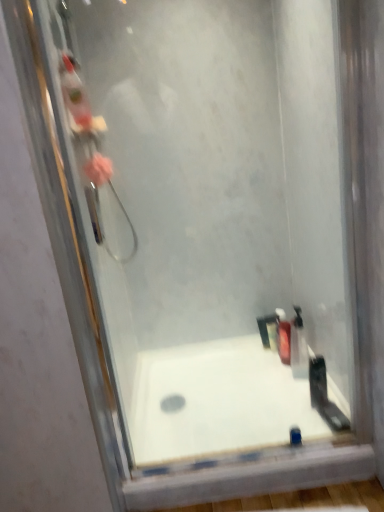
Where is `black plastic razor at right, the third toiletry when ordered from back to front`? The image size is (384, 512). black plastic razor at right, the third toiletry when ordered from back to front is located at coordinates (318, 381).

In order to click on translucent plastic bottle at lower right, which is the second toiletry from front to back in this screenshot , I will do `click(298, 346)`.

Which is behind, point (210, 454) or point (287, 364)?

The point (287, 364) is behind.

From the image's perspective, which one is positioned lower, white glossy bathtub at center or translucent plastic soap dispenser at lower right, the 3th toiletry when ordered from front to back?

From the image's view, white glossy bathtub at center is below.

Based on their positions, is white glossy bathtub at center located to the left or right of translucent plastic soap dispenser at lower right, the 3th toiletry when ordered from front to back?

white glossy bathtub at center is positioned on translucent plastic soap dispenser at lower right, the 3th toiletry when ordered from front to back,'s left side.

Is white glossy bathtub at center thinner than translucent plastic soap dispenser at lower right, placed as the first toiletry when sorted from back to front?

No.

Can you confirm if pink fluffy sponge at left is smaller than translucent plastic soap dispenser at lower right, placed as the first toiletry when sorted from back to front?

Correct, pink fluffy sponge at left occupies less space than translucent plastic soap dispenser at lower right, placed as the first toiletry when sorted from back to front.

Is pink fluffy sponge at left placed right next to translucent plastic soap dispenser at lower right, placed as the first toiletry when sorted from back to front?

There is a gap between pink fluffy sponge at left and translucent plastic soap dispenser at lower right, placed as the first toiletry when sorted from back to front.

Considering the positions of objects pink fluffy sponge at left and translucent plastic soap dispenser at lower right, the 3th toiletry when ordered from front to back, in the image provided, who is in front, pink fluffy sponge at left or translucent plastic soap dispenser at lower right, the 3th toiletry when ordered from front to back,?

pink fluffy sponge at left.

I want to click on bathtub below the pink fluffy sponge at left (from a real-world perspective), so click(217, 401).

Which object is closer to the camera, white glossy bathtub at center or pink fluffy sponge at left?

pink fluffy sponge at left is closer to the camera.

Is white glossy bathtub at center positioned with its back to pink fluffy sponge at left?

white glossy bathtub at center does not have its back to pink fluffy sponge at left.

Is white glossy bathtub at center next to pink fluffy sponge at left and touching it?

There is a gap between white glossy bathtub at center and pink fluffy sponge at left.

Is pink fluffy sponge at left inside or outside of white glossy bathtub at center?

The correct answer is: outside.

Is pink fluffy sponge at left at the right side of white glossy bathtub at center?

In fact, pink fluffy sponge at left is to the left of white glossy bathtub at center.

Is pink fluffy sponge at left closer to the viewer compared to white glossy bathtub at center?

Yes, pink fluffy sponge at left is closer to the camera.

Considering the sizes of objects pink fluffy sponge at left and white glossy bathtub at center in the image provided, who is thinner, pink fluffy sponge at left or white glossy bathtub at center?

With smaller width is pink fluffy sponge at left.

In terms of width, does pink fluffy sponge at left look wider or thinner when compared to black plastic razor at right, which is the first toiletry in front-to-back order?

Clearly, pink fluffy sponge at left has more width compared to black plastic razor at right, which is the first toiletry in front-to-back order.

In terms of size, does pink fluffy sponge at left appear bigger or smaller than black plastic razor at right, the third toiletry when ordered from back to front?

In the image, pink fluffy sponge at left appears to be larger than black plastic razor at right, the third toiletry when ordered from back to front.

At what (x,y) coordinates should I click in order to perform the action: click on flower in front of the black plastic razor at right, the third toiletry when ordered from back to front. Please return your answer as a coordinate pair (x, y). This screenshot has width=384, height=512. Looking at the image, I should click on (98, 169).

In the scene shown: Looking at the image, does translucent plastic soap dispenser at lower right, placed as the first toiletry when sorted from back to front, seem bigger or smaller compared to pink fluffy sponge at left?

translucent plastic soap dispenser at lower right, placed as the first toiletry when sorted from back to front, is bigger than pink fluffy sponge at left.

Is translucent plastic soap dispenser at lower right, the 3th toiletry when ordered from front to back, not inside pink fluffy sponge at left?

Answer: Yes, translucent plastic soap dispenser at lower right, the 3th toiletry when ordered from front to back, is located beyond the bounds of pink fluffy sponge at left.

Is translucent plastic soap dispenser at lower right, placed as the first toiletry when sorted from back to front, facing towards pink fluffy sponge at left?

No, translucent plastic soap dispenser at lower right, placed as the first toiletry when sorted from back to front, is not facing towards pink fluffy sponge at left.

From a real-world perspective, is translucent plastic soap dispenser at lower right, the 3th toiletry when ordered from front to back, above or below pink fluffy sponge at left?

translucent plastic soap dispenser at lower right, the 3th toiletry when ordered from front to back, is situated lower than pink fluffy sponge at left in the real world.

Would you say pink fluffy sponge at left is outside translucent plastic bottle at lower right, which appears as the second toiletry when viewed from the back?

pink fluffy sponge at left is positioned outside translucent plastic bottle at lower right, which appears as the second toiletry when viewed from the back.

Is pink fluffy sponge at left facing towards translucent plastic bottle at lower right, which appears as the second toiletry when viewed from the back?

No, pink fluffy sponge at left is not turned towards translucent plastic bottle at lower right, which appears as the second toiletry when viewed from the back.

Where is `flower to the left of translucent plastic bottle at lower right, which is the second toiletry from front to back`? The width and height of the screenshot is (384, 512). flower to the left of translucent plastic bottle at lower right, which is the second toiletry from front to back is located at coordinates (98, 169).

Can you confirm if pink fluffy sponge at left is thinner than translucent plastic bottle at lower right, which is the second toiletry from front to back?

No, pink fluffy sponge at left is not thinner than translucent plastic bottle at lower right, which is the second toiletry from front to back.

This screenshot has width=384, height=512. Find the location of `toiletry that is the 1st object above the white glossy bathtub at center (from a real-world perspective)`. toiletry that is the 1st object above the white glossy bathtub at center (from a real-world perspective) is located at coordinates (283, 336).

At what (x,y) coordinates should I click in order to perform the action: click on toiletry that is the 1st object to the right of the pink fluffy sponge at left, starting at the anchor. Please return your answer as a coordinate pair (x, y). This screenshot has width=384, height=512. Looking at the image, I should click on (283, 336).

Based on their spatial positions, is pink fluffy sponge at left or translucent plastic soap dispenser at lower right, placed as the first toiletry when sorted from back to front, closer to white glossy bathtub at center?

translucent plastic soap dispenser at lower right, placed as the first toiletry when sorted from back to front, is positioned closer to the anchor white glossy bathtub at center.

From the image, which object appears to be farther from black plastic razor at right, which is the first toiletry in front-to-back order, translucent plastic bottle at lower right, which appears as the second toiletry when viewed from the back, or pink fluffy sponge at left?

Among the two, pink fluffy sponge at left is located further to black plastic razor at right, which is the first toiletry in front-to-back order.

Which object lies nearer to the anchor point translucent plastic bottle at lower right, which appears as the second toiletry when viewed from the back, pink fluffy sponge at left or translucent plastic soap dispenser at lower right, placed as the first toiletry when sorted from back to front?

Based on the image, translucent plastic soap dispenser at lower right, placed as the first toiletry when sorted from back to front, appears to be nearer to translucent plastic bottle at lower right, which appears as the second toiletry when viewed from the back.

Estimate the real-world distances between objects in this image. Which object is closer to black plastic razor at right, the third toiletry when ordered from back to front, white glossy bathtub at center or translucent plastic bottle at lower right, which appears as the second toiletry when viewed from the back?

Among the two, translucent plastic bottle at lower right, which appears as the second toiletry when viewed from the back, is located nearer to black plastic razor at right, the third toiletry when ordered from back to front.

Looking at the image, which one is located further to pink fluffy sponge at left, white glossy bathtub at center or translucent plastic soap dispenser at lower right, the 3th toiletry when ordered from front to back?

Based on the image, translucent plastic soap dispenser at lower right, the 3th toiletry when ordered from front to back, appears to be further to pink fluffy sponge at left.

Estimate the real-world distances between objects in this image. Which object is further from black plastic razor at right, the third toiletry when ordered from back to front, translucent plastic soap dispenser at lower right, placed as the first toiletry when sorted from back to front, or translucent plastic bottle at lower right, which appears as the second toiletry when viewed from the back?

translucent plastic soap dispenser at lower right, placed as the first toiletry when sorted from back to front, lies further to black plastic razor at right, the third toiletry when ordered from back to front, than the other object.

From the picture: Which object lies further to the anchor point black plastic razor at right, the third toiletry when ordered from back to front, translucent plastic bottle at lower right, which appears as the second toiletry when viewed from the back, or white glossy bathtub at center?

Among the two, white glossy bathtub at center is located further to black plastic razor at right, the third toiletry when ordered from back to front.

Which object lies nearer to the anchor point pink fluffy sponge at left, black plastic razor at right, which is the first toiletry in front-to-back order, or translucent plastic soap dispenser at lower right, the 3th toiletry when ordered from front to back?

Based on the image, black plastic razor at right, which is the first toiletry in front-to-back order, appears to be nearer to pink fluffy sponge at left.

At what (x,y) coordinates should I click in order to perform the action: click on toiletry between pink fluffy sponge at left and black plastic razor at right, which is the first toiletry in front-to-back order, from left to right. Please return your answer as a coordinate pair (x, y). Looking at the image, I should click on (283, 336).

Image resolution: width=384 pixels, height=512 pixels. I want to click on toiletry located between white glossy bathtub at center and translucent plastic bottle at lower right, which appears as the second toiletry when viewed from the back, in the depth direction, so click(x=318, y=381).

I want to click on toiletry between black plastic razor at right, which is the first toiletry in front-to-back order, and translucent plastic soap dispenser at lower right, the 3th toiletry when ordered from front to back, along the z-axis, so [x=298, y=346].